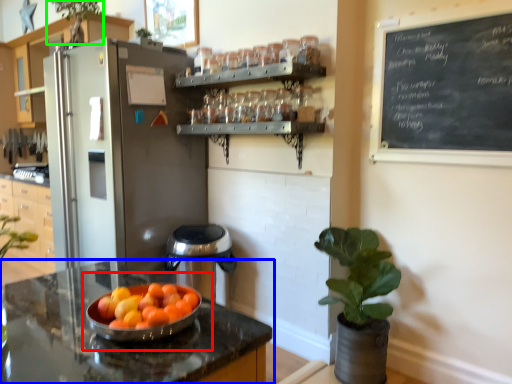
Question: Considering the real-world distances, which object is closest to fruit dish (highlighted by a red box)? countertop (highlighted by a blue box) or plant (highlighted by a green box).

Choices:
 (A) countertop
 (B) plant

Answer: (A)